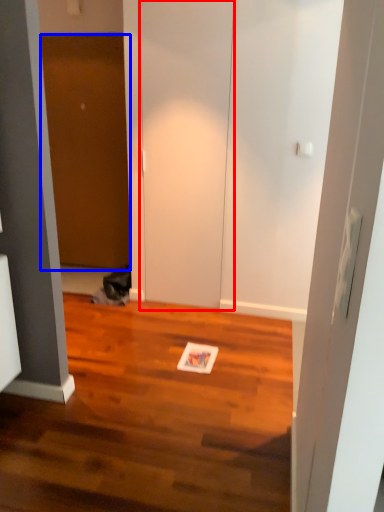
Question: Among these objects, which one is nearest to the camera, door (highlighted by a red box) or door (highlighted by a blue box)?

Choices:
 (A) door
 (B) door

Answer: (A)